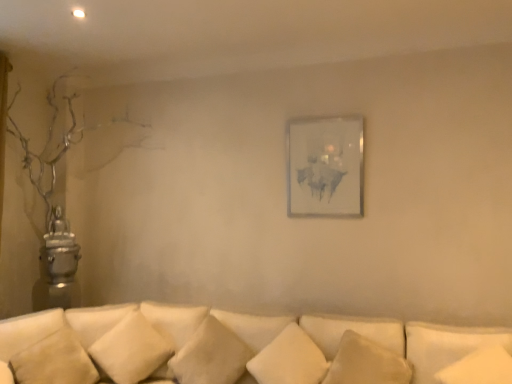
Question: From the image's perspective, is white soft pillow at lower right, the seventh pillow viewed from the left, located above or below white soft pillow at lower center, the fifth pillow viewed from the right?

Choices:
 (A) above
 (B) below

Answer: (A)

Question: Is point (418, 339) positioned closer to the camera than point (160, 350)?

Choices:
 (A) farther
 (B) closer

Answer: (B)

Question: Considering the real-world distances, which object is farthest from the beige fabric pillow at lower left, which is the 6th pillow from right to left?

Choices:
 (A) white soft pillow at lower center, the 6th pillow when ordered from left to right
 (B) matte white picture frame at center
 (C) soft beige cushion at center, positioned as the 4th pillow in right-to-left order
 (D) white fabric couch at lower center
 (E) white soft pillow at lower right, the seventh pillow viewed from the left

Answer: (E)

Question: Based on their relative distances, which object is nearer to the white fabric couch at lower center?

Choices:
 (A) white soft pillow at lower center, the fifth pillow viewed from the right
 (B) beige fabric pillow at lower left, the second pillow from the left
 (C) soft beige cushion at center, the 4th pillow from the left
 (D) white soft pillow at center, the third pillow viewed from the right
 (E) white soft pillow at lower right, the seventh pillow viewed from the left

Answer: (C)